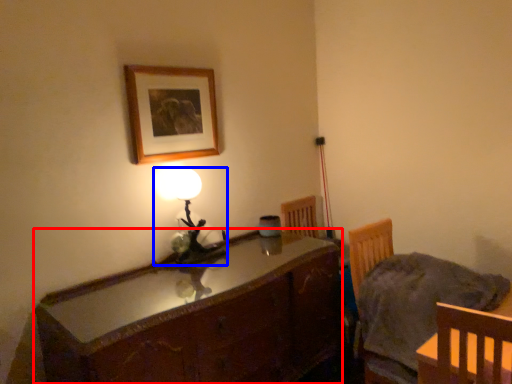
Question: Among these objects, which one is nearest to the camera, cabinetry (highlighted by a red box) or lamp (highlighted by a blue box)?

Choices:
 (A) cabinetry
 (B) lamp

Answer: (A)